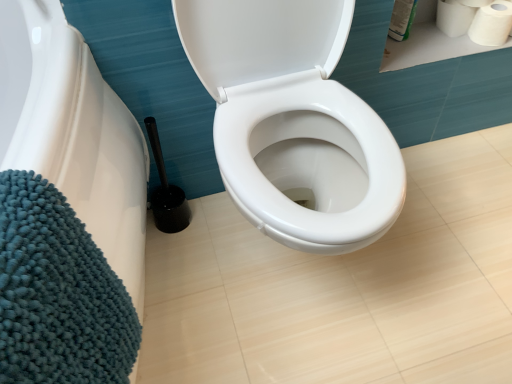
Question: Choose the correct answer: Is teal plush bath mat at lower left inside black plastic toilet brush at lower left or outside it?

Choices:
 (A) outside
 (B) inside

Answer: (A)

Question: Is point (50, 19) positioned closer to the camera than point (181, 213)?

Choices:
 (A) farther
 (B) closer

Answer: (B)

Question: Estimate the real-world distances between objects in this image. Which object is farther from the teal plush bath mat at lower left?

Choices:
 (A) white matte toilet paper at upper right, the 1th toilet paper positioned from the right
 (B) white matte toilet paper at upper right, arranged as the first toilet paper when viewed from the left
 (C) black plastic toilet brush at lower left

Answer: (A)

Question: Estimate the real-world distances between objects in this image. Which object is farther from the black plastic toilet brush at lower left?

Choices:
 (A) white matte toilet paper at upper right, marked as the 2th toilet paper in a right-to-left arrangement
 (B) teal plush bath mat at lower left
 (C) white matte toilet paper at upper right, which is the 2th toilet paper in left-to-right order

Answer: (C)